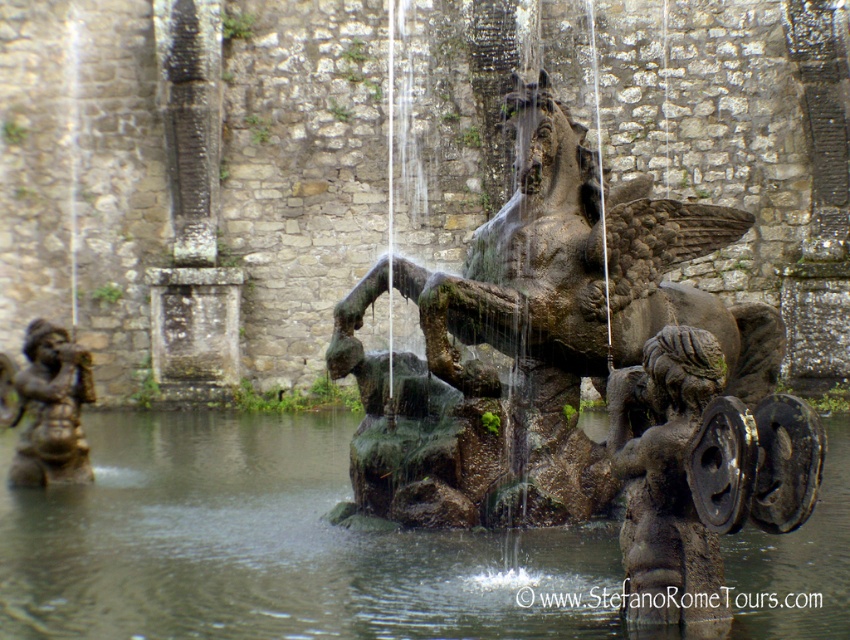
You are standing in front of the fountain and want to touch both the greenish stone horse at center and the bronze statue at left. Which one would you reach first?

You would reach the greenish stone horse at center first because it is closer to you than the bronze statue at left.

Based on the scene description, where is the greenish stone horse at center located in terms of its 2D coordinates?

The greenish stone horse at center is located at the 2D coordinates of point (582, 376).

You are standing in front of the fountain and want to reach the bronze statue at left without stepping into the water. Is there a path available around the green mossy water at center?

The green mossy water at center is in front of the bronze statue at left, so the statue is behind the water. To reach the bronze statue at left without stepping into the water, you would need to go around the fountain to the side, as the statue is behind the central water feature.